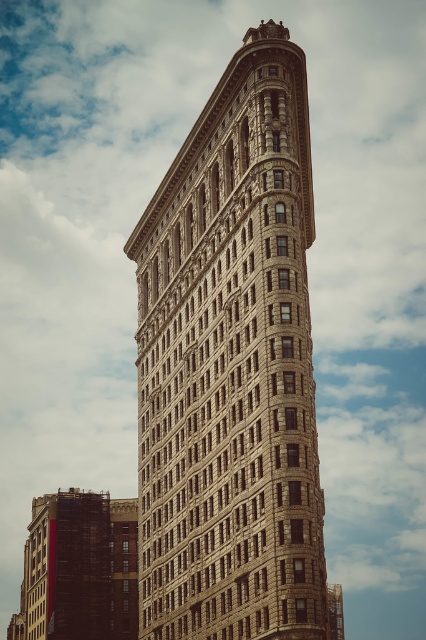
Between brown stone building at center and brown brick building at lower left, which one is positioned lower?

brown brick building at lower left is below.

Who is positioned more to the left, brown stone building at center or brown brick building at lower left?

brown brick building at lower left

From the picture: Measure the distance between brown stone building at center and camera.

brown stone building at center is 49.91 meters away from camera.

Find the location of a particular element. The image size is (426, 640). brown stone building at center is located at coordinates (232, 369).

Between brown stone building at center and gold textured clock at center, which one has more height?

brown stone building at center is taller.

Does brown stone building at center have a smaller size compared to gold textured clock at center?

No, brown stone building at center is not smaller than gold textured clock at center.

Image resolution: width=426 pixels, height=640 pixels. Describe the element at coordinates (232, 369) in the screenshot. I see `brown stone building at center` at that location.

This screenshot has width=426, height=640. In order to click on brown stone building at center in this screenshot , I will do `click(232, 369)`.

Between brown brick building at lower left and gold textured clock at center, which one is positioned lower?

brown brick building at lower left

Does brown brick building at lower left appear under gold textured clock at center?

Correct, brown brick building at lower left is located below gold textured clock at center.

At what (x,y) coordinates should I click in order to perform the action: click on brown brick building at lower left. Please return your answer as a coordinate pair (x, y). Image resolution: width=426 pixels, height=640 pixels. Looking at the image, I should click on (78, 568).

Where is `brown brick building at lower left`? This screenshot has height=640, width=426. brown brick building at lower left is located at coordinates (78, 568).